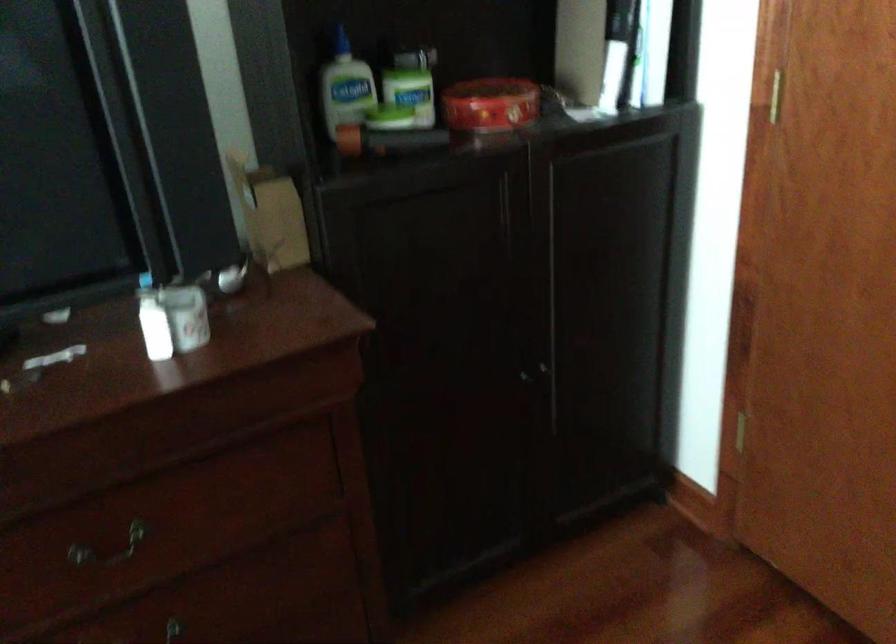
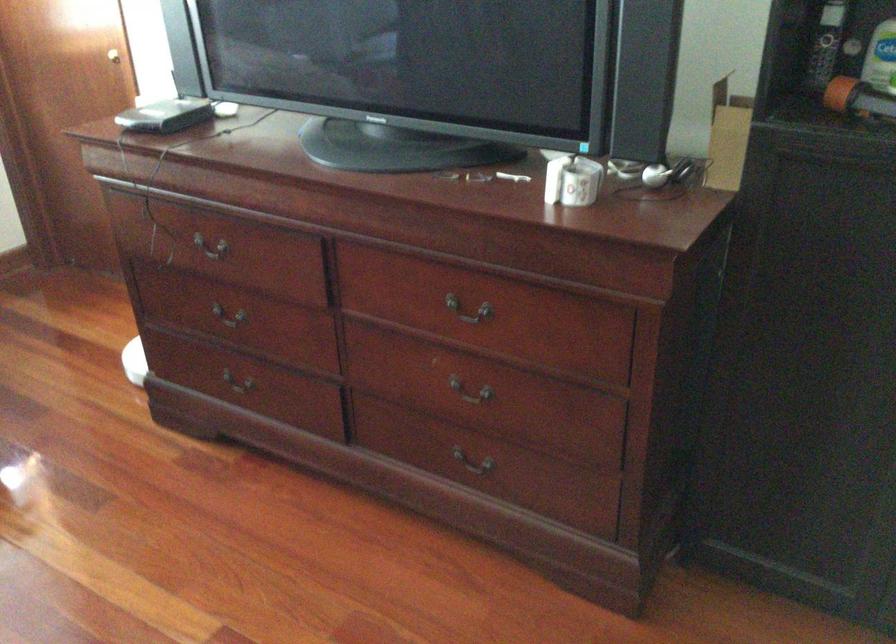
Find the pixel in the second image that matches [106,540] in the first image.

(469, 310)